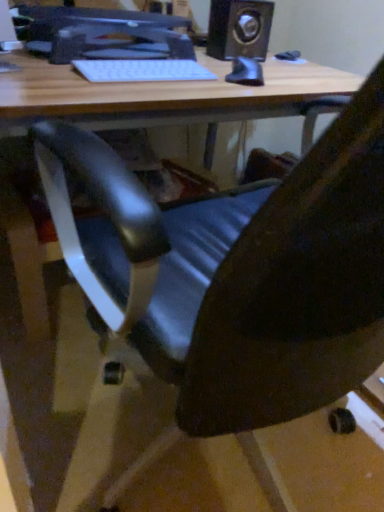
Question: In terms of size, does matte black monitor at upper center appear bigger or smaller than white matte keyboard at upper center?

Choices:
 (A) small
 (B) big

Answer: (B)

Question: Which is correct: matte black monitor at upper center is inside white matte keyboard at upper center, or outside of it?

Choices:
 (A) inside
 (B) outside

Answer: (B)

Question: Based on their relative distances, which object is farther from the black plastic speaker at upper right?

Choices:
 (A) white matte keyboard at upper center
 (B) matte black monitor at upper center

Answer: (B)

Question: Considering the real-world distances, which object is farthest from the matte black monitor at upper center?

Choices:
 (A) white matte keyboard at upper center
 (B) black plastic speaker at upper right

Answer: (B)